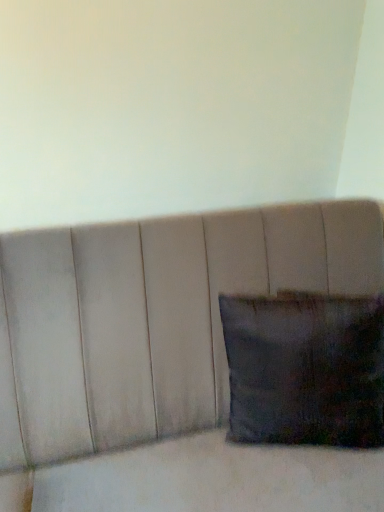
Question: From the image's perspective, is dark fabric pillow at lower right above suede-like beige cushion at center?

Choices:
 (A) no
 (B) yes

Answer: (B)

Question: From a real-world perspective, is dark fabric pillow at lower right located beneath suede-like beige cushion at center?

Choices:
 (A) no
 (B) yes

Answer: (A)

Question: Considering the relative sizes of dark fabric pillow at lower right and suede-like beige cushion at center in the image provided, is dark fabric pillow at lower right taller than suede-like beige cushion at center?

Choices:
 (A) yes
 (B) no

Answer: (B)

Question: Is suede-like beige cushion at center completely or partially inside dark fabric pillow at lower right?

Choices:
 (A) yes
 (B) no

Answer: (B)

Question: Is dark fabric pillow at lower right outside of suede-like beige cushion at center?

Choices:
 (A) yes
 (B) no

Answer: (B)

Question: Does dark fabric pillow at lower right have a larger size compared to suede-like beige cushion at center?

Choices:
 (A) yes
 (B) no

Answer: (B)

Question: Is dark fabric pillow at lower right completely or partially inside suede-like beige cushion at center?

Choices:
 (A) no
 (B) yes

Answer: (B)

Question: Considering the relative sizes of suede-like beige cushion at center and dark fabric pillow at lower right in the image provided, is suede-like beige cushion at center bigger than dark fabric pillow at lower right?

Choices:
 (A) no
 (B) yes

Answer: (B)

Question: Is suede-like beige cushion at center in front of dark fabric pillow at lower right?

Choices:
 (A) no
 (B) yes

Answer: (B)

Question: Is suede-like beige cushion at center outside of dark fabric pillow at lower right?

Choices:
 (A) yes
 (B) no

Answer: (A)

Question: From the image's perspective, is suede-like beige cushion at center beneath dark fabric pillow at lower right?

Choices:
 (A) no
 (B) yes

Answer: (B)

Question: Would you say suede-like beige cushion at center is a long distance from dark fabric pillow at lower right?

Choices:
 (A) no
 (B) yes

Answer: (A)

Question: Is dark fabric pillow at lower right wider or thinner than suede-like beige cushion at center?

Choices:
 (A) thin
 (B) wide

Answer: (A)